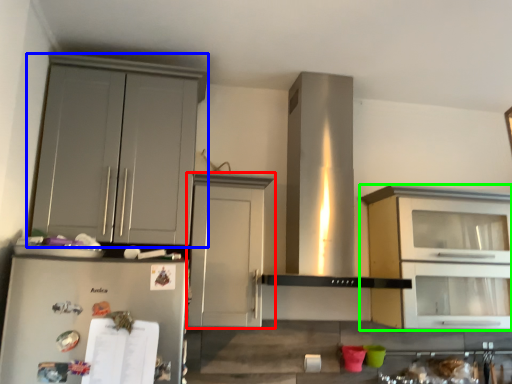
Question: Based on their relative distances, which object is farther from cabinetry (highlighted by a red box)? Choose from cabinetry (highlighted by a blue box) and cabinetry (highlighted by a green box).

Choices:
 (A) cabinetry
 (B) cabinetry

Answer: (B)